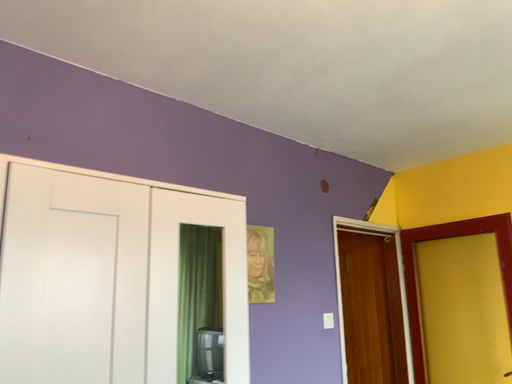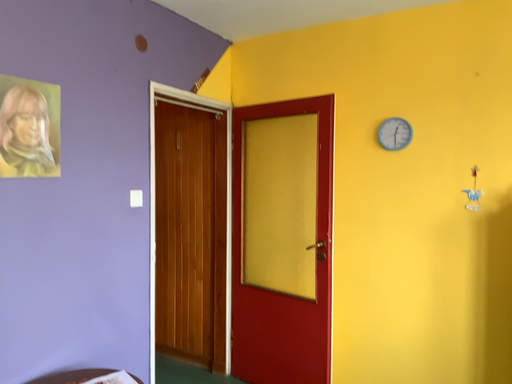
Question: How did the camera likely rotate when shooting the video?

Choices:
 (A) rotated left
 (B) rotated right

Answer: (B)